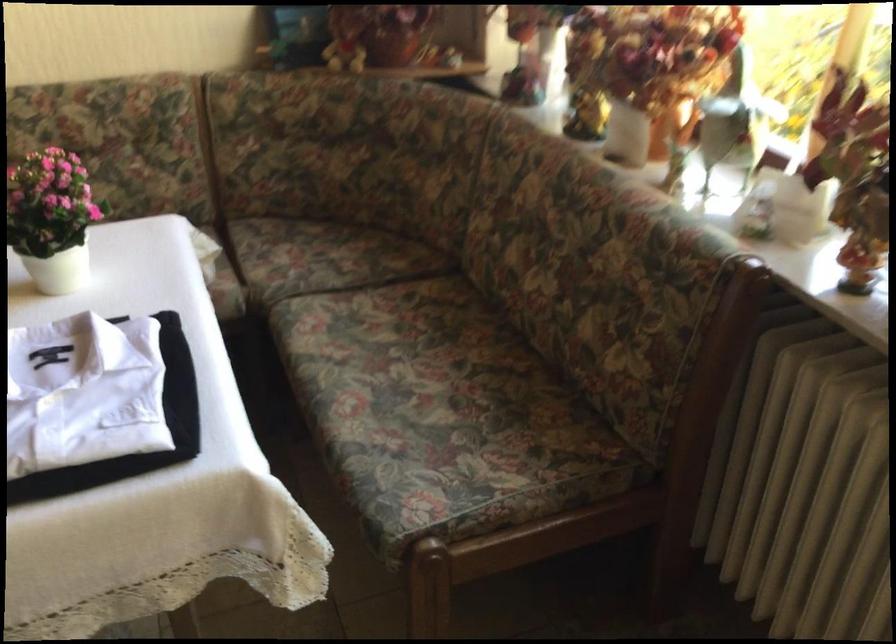
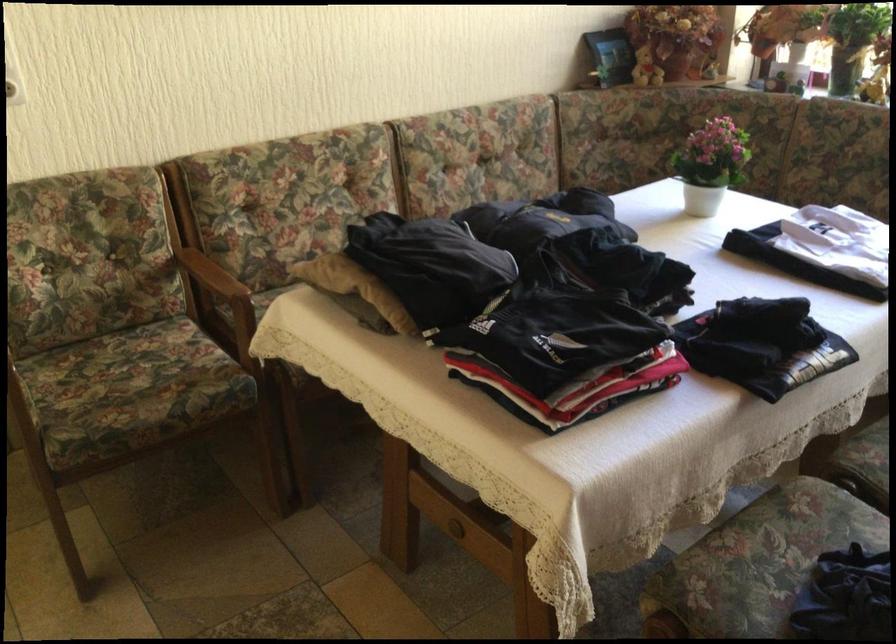
Question: I am providing you with two images of the same scene from different viewpoints. Please identify which objects are invisible in image2.

Choices:
 (A) floral sofa sitting surface
 (B) green magazine file
 (C) white flower pot
 (D) wooden chair armrest

Answer: (A)